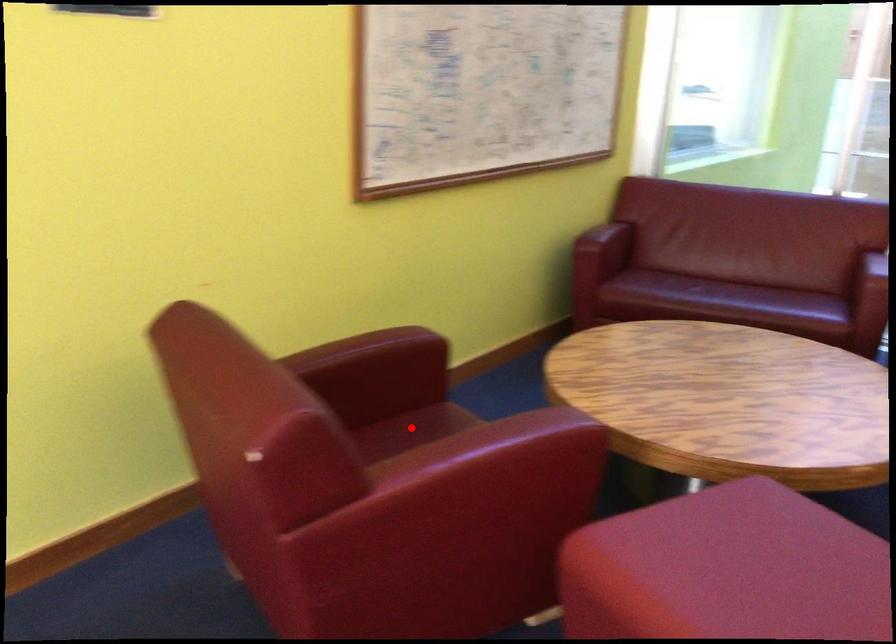
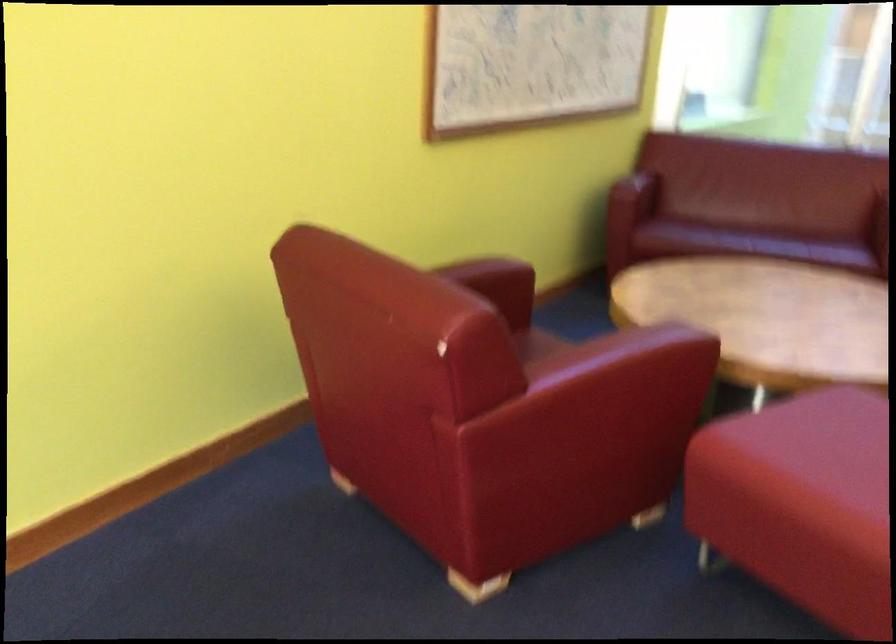
Question: I am providing you with two images of the same scene from different viewpoints. A red point is marked on the first image. Can you still see the location of the red point in image 2?

Choices:
 (A) Yes
 (B) No

Answer: (B)